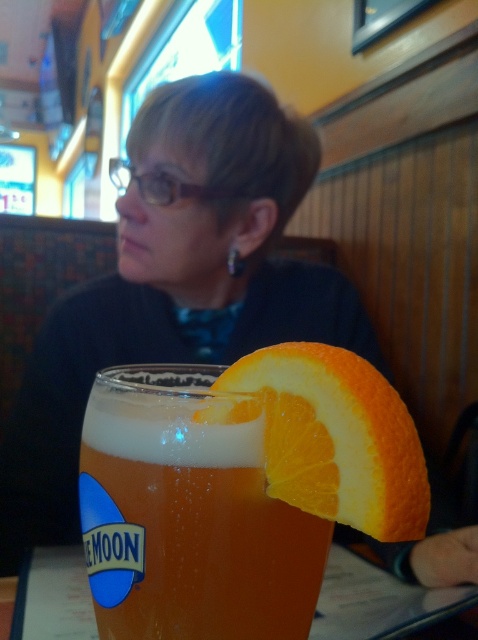
You are a GUI agent. You are given a task and a screenshot of the screen. Output one action in this format:
    pyautogui.click(x=<x>, y=<y>)
    Task: Click on the translucent glass beer at center
    
    Given the screenshot: What is the action you would take?
    pyautogui.click(x=188, y=516)

Which is in front, point (132, 412) or point (367, 374)?

Positioned in front is point (367, 374).

Does point (108, 529) come behind point (332, 380)?

Yes, it is behind point (332, 380).

Image resolution: width=478 pixels, height=640 pixels. Find the location of `translucent glass beer at center`. translucent glass beer at center is located at coordinates (188, 516).